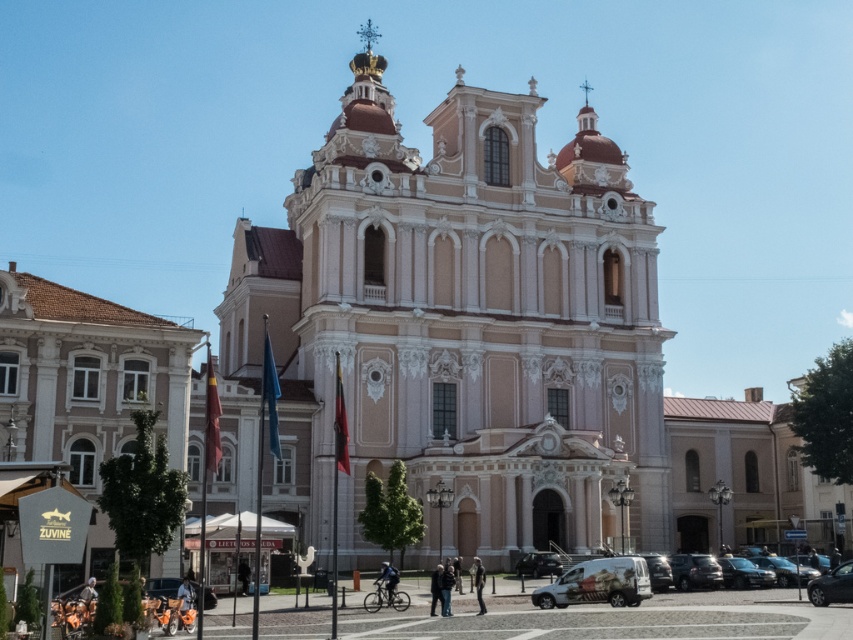
From the picture: You are a photographer setting up a tripod in the town square. You need to position your equipment between the metallic silver van at lower center and the black glossy car at lower right. Considering their sizes, which vehicle should you avoid placing your tripod next to to ensure enough space?

You should avoid placing your tripod next to the metallic silver van at lower center because it is wider than the black glossy car at lower right, leaving less space between them.

You are standing in the town square facing the grand building. You see a metallic silver van at lower center and a metallic silver car at lower right. Which vehicle is nearer to you?

The metallic silver van at lower center is closer to the viewer than the metallic silver car at lower right.

You are driving a car and want to park in the town square near the grand ornate building. You see the metallic silver van at lower center and the black glossy car at lower right. Which vehicle should you move around to access the parking spot behind both?

You should move around the metallic silver van at lower center because it is in front of the black glossy car at lower right, so accessing the parking spot behind both would require moving past the van first.